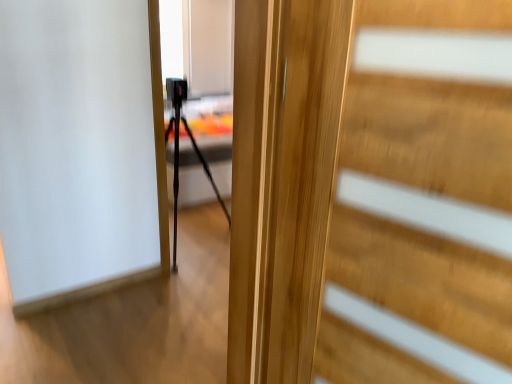
Question: Can you confirm if wooden door at center is wider than black matte tripod at center?

Choices:
 (A) no
 (B) yes

Answer: (A)

Question: Is wooden door at center not close to black matte tripod at center?

Choices:
 (A) no
 (B) yes

Answer: (B)

Question: From the image's perspective, would you say wooden door at center is shown under black matte tripod at center?

Choices:
 (A) yes
 (B) no

Answer: (A)

Question: Would you say black matte tripod at center is part of wooden door at center's contents?

Choices:
 (A) no
 (B) yes

Answer: (A)

Question: Is wooden door at center next to black matte tripod at center and touching it?

Choices:
 (A) no
 (B) yes

Answer: (A)

Question: Does wooden door at center have a lesser width compared to black matte tripod at center?

Choices:
 (A) no
 (B) yes

Answer: (B)

Question: Is black matte tripod at center to the left of wooden door at center from the viewer's perspective?

Choices:
 (A) no
 (B) yes

Answer: (B)

Question: From a real-world perspective, is black matte tripod at center physically above wooden door at center?

Choices:
 (A) yes
 (B) no

Answer: (B)

Question: Does black matte tripod at center have a lesser height compared to wooden door at center?

Choices:
 (A) yes
 (B) no

Answer: (B)

Question: Considering the relative sizes of black matte tripod at center and wooden door at center in the image provided, is black matte tripod at center bigger than wooden door at center?

Choices:
 (A) yes
 (B) no

Answer: (A)

Question: From the image's perspective, would you say black matte tripod at center is positioned over wooden door at center?

Choices:
 (A) no
 (B) yes

Answer: (B)

Question: Is black matte tripod at center positioned before wooden door at center?

Choices:
 (A) no
 (B) yes

Answer: (A)

Question: Would you say black matte tripod at center is inside or outside wooden door at center?

Choices:
 (A) outside
 (B) inside

Answer: (A)